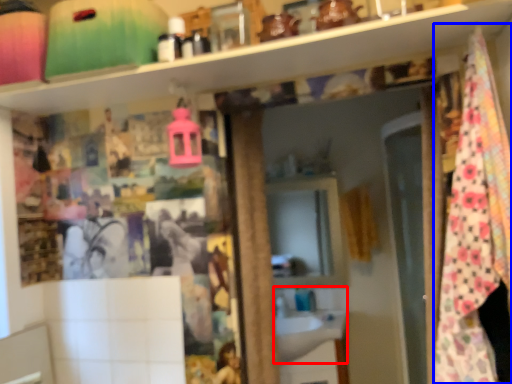
Question: Which point is further to the camera, sink (highlighted by a red box) or blanket (highlighted by a blue box)?

Choices:
 (A) sink
 (B) blanket

Answer: (A)